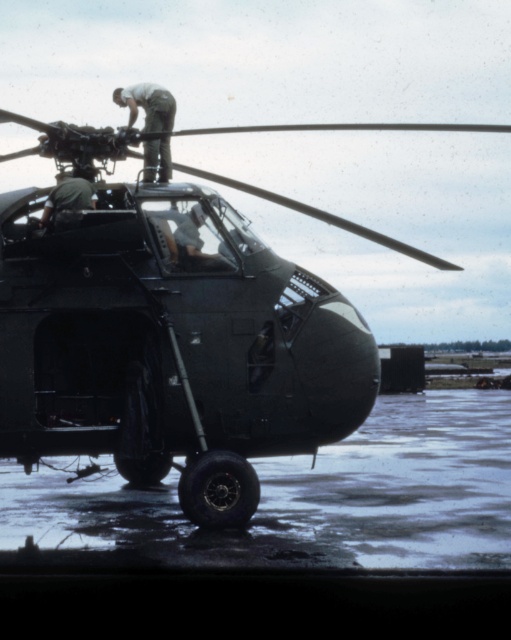
Question: Is green fabric man at upper center wider than green matte uniform at center?

Choices:
 (A) yes
 (B) no

Answer: (A)

Question: Does matte black helicopter at center lie in front of green fabric man at upper center?

Choices:
 (A) no
 (B) yes

Answer: (B)

Question: Which of the following is the farthest from the observer?

Choices:
 (A) green matte uniform at center
 (B) green fabric man at upper center

Answer: (B)

Question: Is green fabric man at upper center in front of green matte uniform at center?

Choices:
 (A) yes
 (B) no

Answer: (B)

Question: Which point appears closest to the camera in this image?

Choices:
 (A) (107, 401)
 (B) (41, 216)
 (C) (170, 118)

Answer: (A)

Question: Which point is closer to the camera?

Choices:
 (A) green matte uniform at center
 (B) green fabric man at upper center
 (C) matte black helicopter at center

Answer: (C)